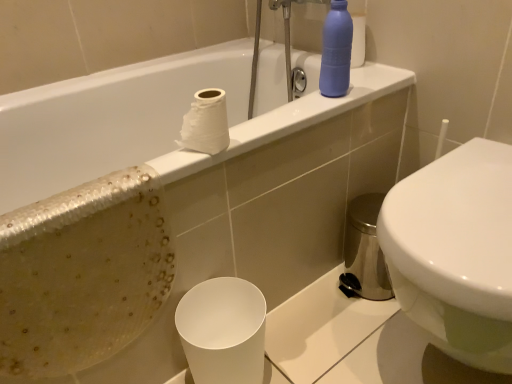
Question: Should I look upward or downward to see white matte paper cup at lower center?

Choices:
 (A) down
 (B) up

Answer: (A)

Question: From a real-world perspective, is matte blue bottle at upper right located beneath white matte paper cup at lower center?

Choices:
 (A) yes
 (B) no

Answer: (B)

Question: Is matte blue bottle at upper right further to the viewer compared to white matte paper cup at lower center?

Choices:
 (A) no
 (B) yes

Answer: (B)

Question: Is matte blue bottle at upper right outside of white matte paper cup at lower center?

Choices:
 (A) yes
 (B) no

Answer: (A)

Question: Is matte blue bottle at upper right in contact with white matte paper cup at lower center?

Choices:
 (A) yes
 (B) no

Answer: (B)

Question: Can you confirm if matte blue bottle at upper right is positioned to the right of white matte paper cup at lower center?

Choices:
 (A) yes
 (B) no

Answer: (A)

Question: Is matte blue bottle at upper right oriented towards white matte paper cup at lower center?

Choices:
 (A) yes
 (B) no

Answer: (B)

Question: Is white matte paper cup at lower center looking in the opposite direction of matte blue bottle at upper right?

Choices:
 (A) yes
 (B) no

Answer: (B)

Question: Is white matte paper cup at lower center to the left of matte blue bottle at upper right from the viewer's perspective?

Choices:
 (A) no
 (B) yes

Answer: (B)

Question: From the image's perspective, is white matte paper cup at lower center beneath matte blue bottle at upper right?

Choices:
 (A) no
 (B) yes

Answer: (B)

Question: Considering the relative sizes of white matte paper cup at lower center and matte blue bottle at upper right in the image provided, is white matte paper cup at lower center wider than matte blue bottle at upper right?

Choices:
 (A) yes
 (B) no

Answer: (A)

Question: Could you tell me if white matte paper cup at lower center is turned towards matte blue bottle at upper right?

Choices:
 (A) no
 (B) yes

Answer: (A)

Question: Is white matte paper cup at lower center taller than matte blue bottle at upper right?

Choices:
 (A) no
 (B) yes

Answer: (B)

Question: Does white matte toilet paper at upper center turn towards matte blue bottle at upper right?

Choices:
 (A) no
 (B) yes

Answer: (A)